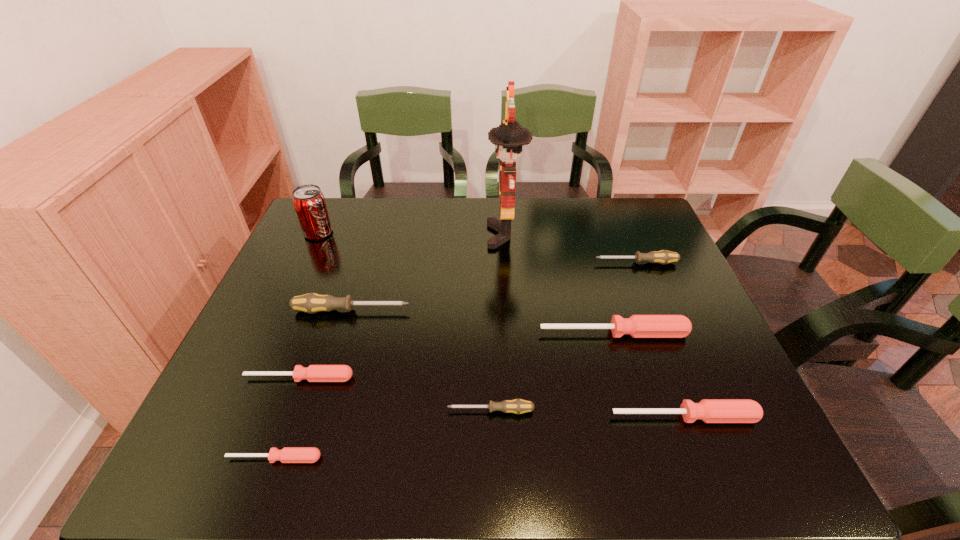
In order to click on blank area located at the tip of the leftmost gray screwdriver in this screenshot , I will do `click(484, 310)`.

What are the coordinates of `vacant space located 0.230m on the front of the fifth nearest object` in the screenshot? It's located at (642, 430).

The width and height of the screenshot is (960, 540). Find the location of `free space located at the tip of the farthest screwdriver`. free space located at the tip of the farthest screwdriver is located at coordinates (549, 263).

Find the location of a particular element. vacant area situated at the tip of the farthest screwdriver is located at coordinates (456, 263).

You are a GUI agent. You are given a task and a screenshot of the screen. Output one action in this format:
    pyautogui.click(x=<x>, y=<y>)
    Task: Click on the vacant space positioned 0.210m at the tip of the farthest screwdriver
    
    Given the screenshot: What is the action you would take?
    pyautogui.click(x=521, y=263)

Image resolution: width=960 pixels, height=540 pixels. Find the location of `free point located 0.400m on the back of the second nearest red screwdriver`. free point located 0.400m on the back of the second nearest red screwdriver is located at coordinates (632, 279).

The height and width of the screenshot is (540, 960). Find the location of `free space located 0.180m on the right of the second smallest red screwdriver`. free space located 0.180m on the right of the second smallest red screwdriver is located at coordinates (435, 378).

Find the location of a particular element. Image resolution: width=960 pixels, height=540 pixels. blank area located 0.360m at the tip of the smallest gray screwdriver is located at coordinates (275, 411).

The height and width of the screenshot is (540, 960). I want to click on vacant position located 0.300m at the tip of the smallest gray screwdriver, so click(303, 411).

At what (x,y) coordinates should I click in order to perform the action: click on free space located at the tip of the smallest gray screwdriver. Please return your answer as a coordinate pair (x, y). Looking at the image, I should click on (409, 411).